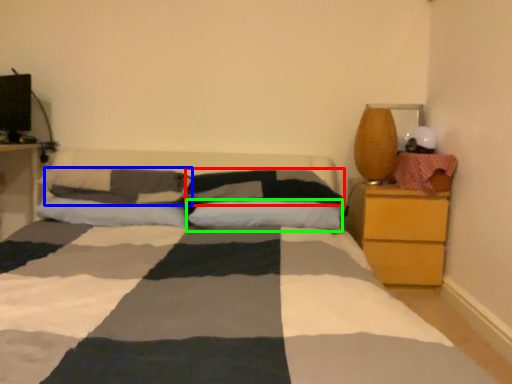
Question: Which is nearer to the pillow (highlighted by a red box)? pillow (highlighted by a blue box) or pillow (highlighted by a green box).

Choices:
 (A) pillow
 (B) pillow

Answer: (B)